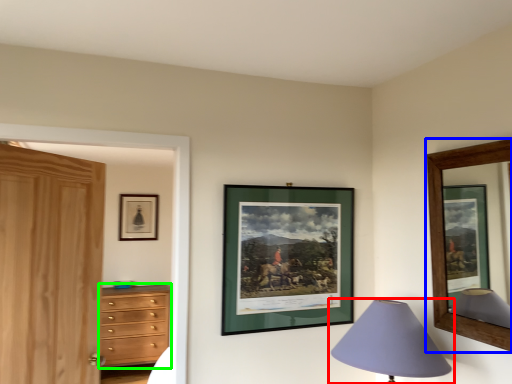
Question: Which object is the closest to the lamp (highlighted by a red box)? Choose among these: picture frame (highlighted by a blue box) or chest of drawers (highlighted by a green box).

Choices:
 (A) picture frame
 (B) chest of drawers

Answer: (A)